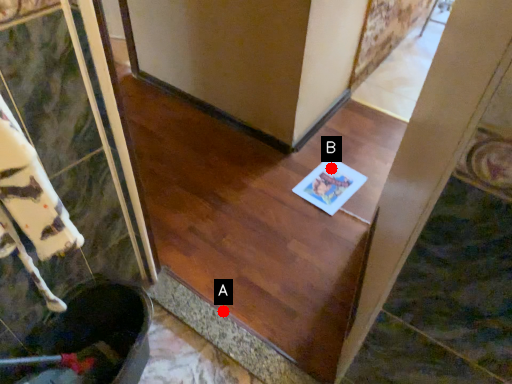
Question: Two points are circled on the image, labeled by A and B beside each circle. Which point is further to the camera?

Choices:
 (A) A is further
 (B) B is further

Answer: (B)